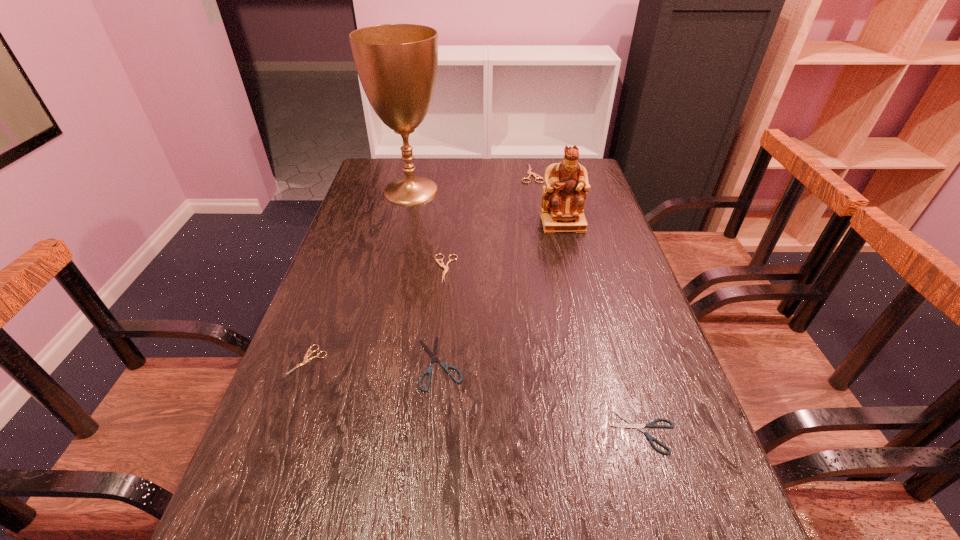
Locate an element on the screen. The width and height of the screenshot is (960, 540). trophy cup is located at coordinates (397, 64).

Where is `the sixth shortest object`? The width and height of the screenshot is (960, 540). the sixth shortest object is located at coordinates (566, 183).

The image size is (960, 540). What are the coordinates of `the fifth nearest object` in the screenshot? It's located at (566, 183).

What are the coordinates of `the farthest beige shears` in the screenshot? It's located at (530, 173).

What are the coordinates of `the rightmost beige shears` in the screenshot? It's located at (530, 173).

Where is `the fourth farthest object`? This screenshot has width=960, height=540. the fourth farthest object is located at coordinates (438, 261).

Where is `the second beige shears from left to right`? This screenshot has height=540, width=960. the second beige shears from left to right is located at coordinates (438, 261).

I want to click on the farther black shears, so click(433, 354).

Locate an element on the screen. Image resolution: width=960 pixels, height=540 pixels. the left black shears is located at coordinates (433, 354).

The height and width of the screenshot is (540, 960). I want to click on the leftmost beige shears, so click(x=307, y=355).